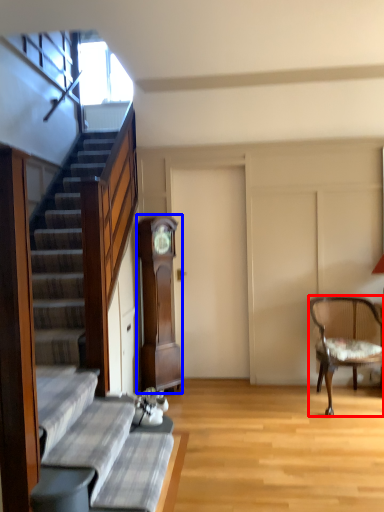
Question: Which object is closer to the camera taking this photo, chair (highlighted by a red box) or cabinetry (highlighted by a blue box)?

Choices:
 (A) chair
 (B) cabinetry

Answer: (A)